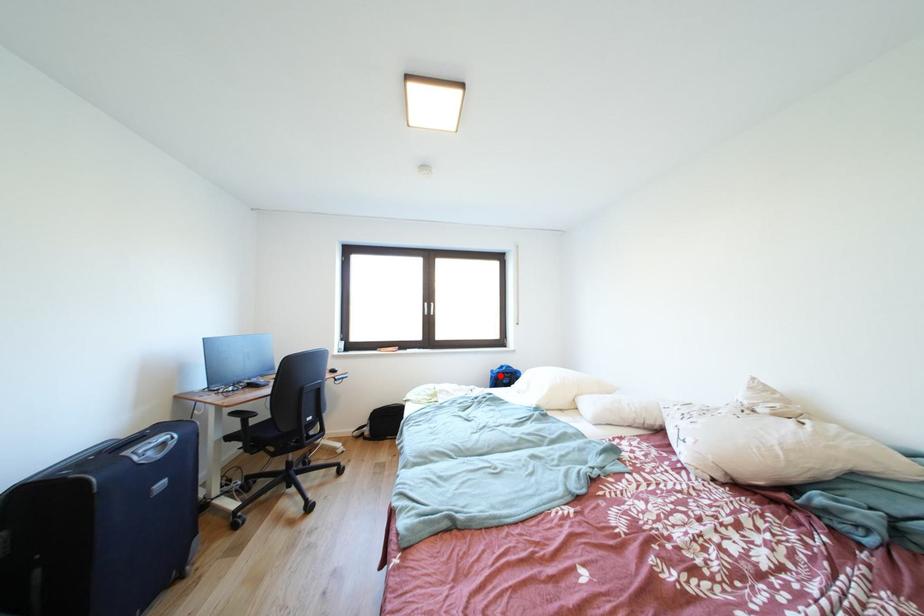
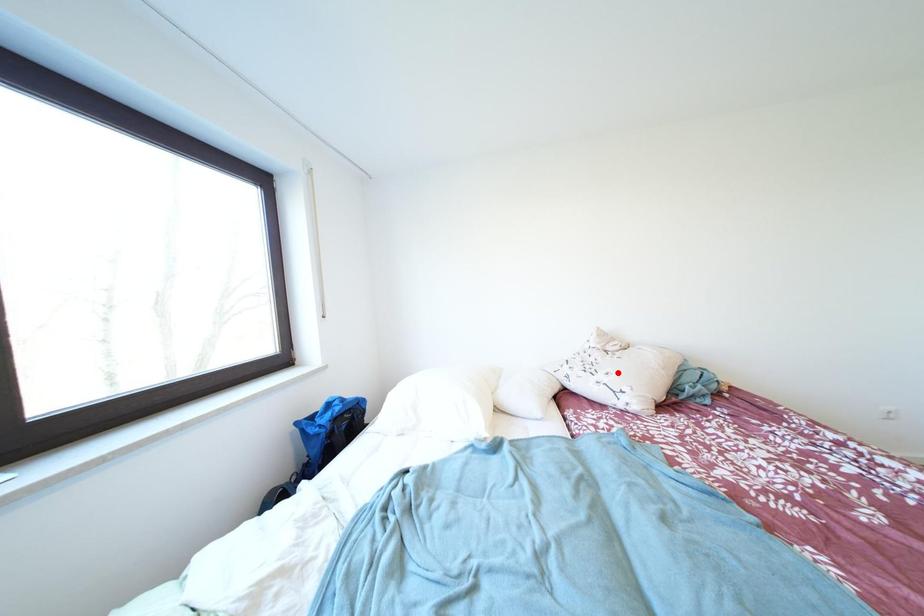
I am providing you with two images of the same scene from different viewpoints. A red point is marked on the first image and another point is marked on the second image. Do the highlighted points in image1 and image2 indicate the same real-world spot?

No